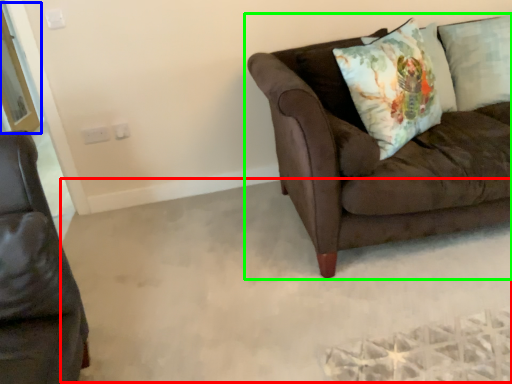
Question: Based on their relative distances, which object is nearer to plain (highlighted by a red box)? Choose from screen door (highlighted by a blue box) and studio couch (highlighted by a green box).

Choices:
 (A) screen door
 (B) studio couch

Answer: (B)